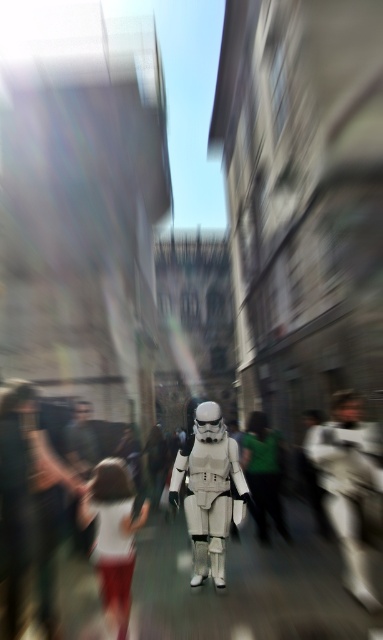
Is white matte stormtrooper at center below white cotton dress at lower left?

No, white matte stormtrooper at center is not below white cotton dress at lower left.

Between white matte stormtrooper at center and white cotton dress at lower left, which one has more height?

white matte stormtrooper at center

Does point (198, 420) come closer to viewer compared to point (108, 508)?

No, (198, 420) is behind (108, 508).

Locate an element on the screen. This screenshot has width=383, height=640. white matte stormtrooper at center is located at coordinates (209, 490).